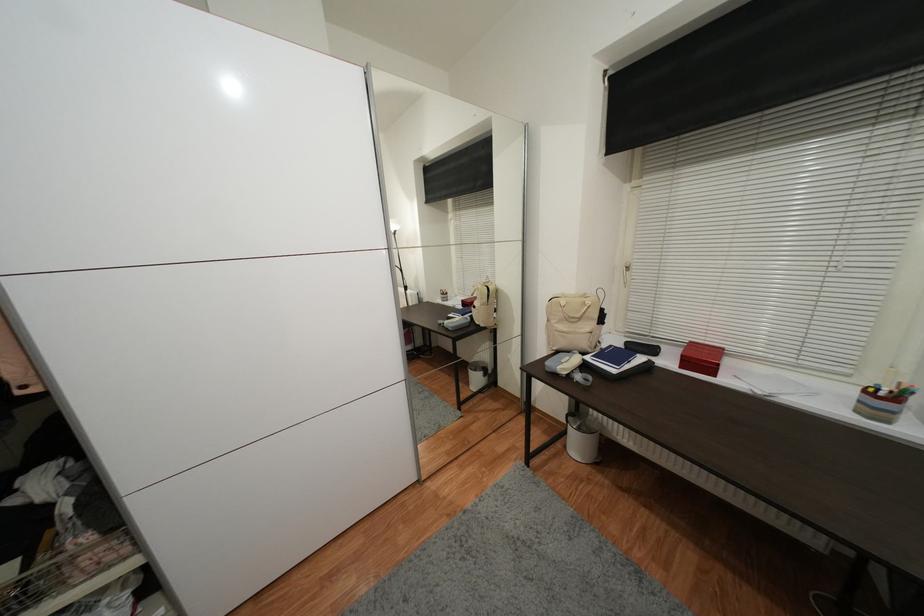
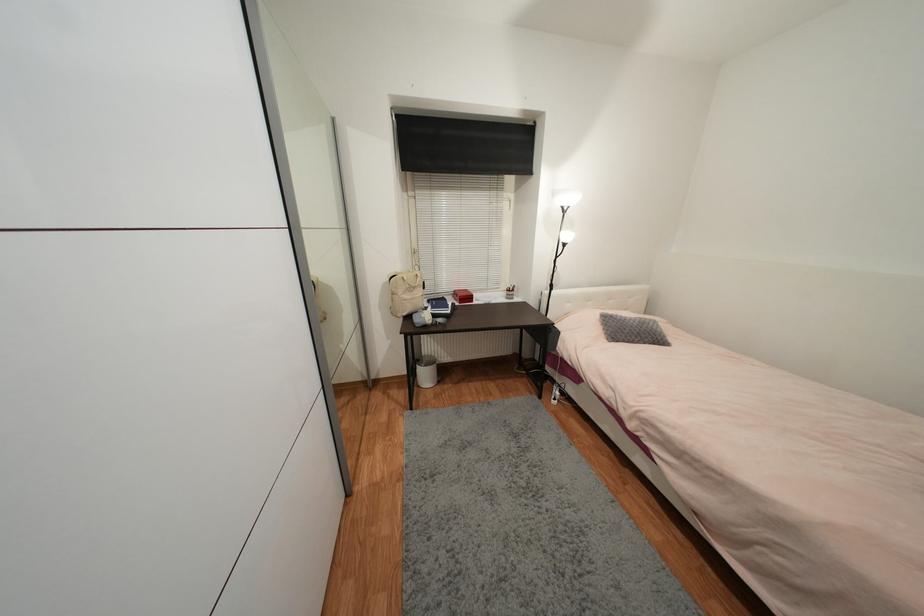
In the second image, find the point that corresponds to pixel 589 297 in the first image.

(412, 273)